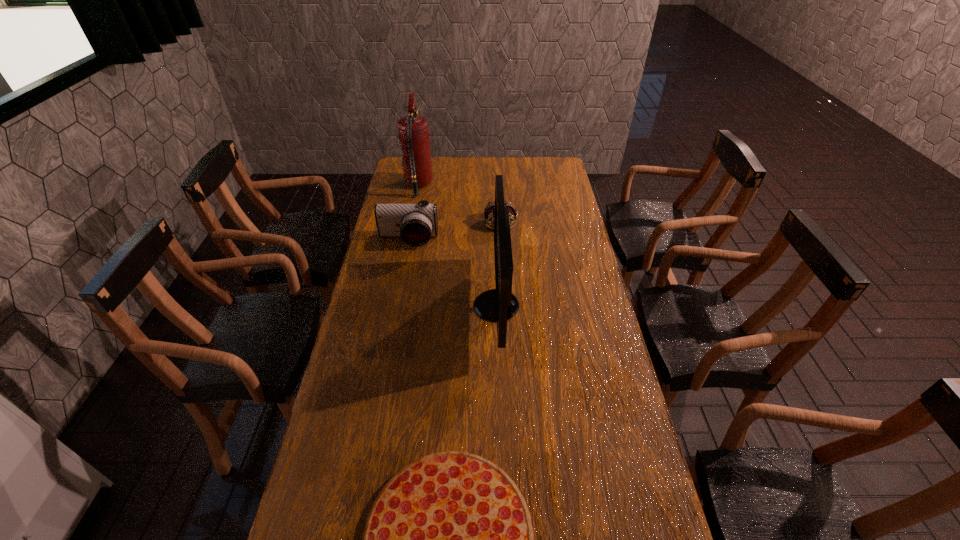
What are the coordinates of `the farthest object` in the screenshot? It's located at (413, 130).

I want to click on the second nearest object, so click(499, 304).

You are a GUI agent. You are given a task and a screenshot of the screen. Output one action in this format:
    pyautogui.click(x=<x>, y=<y>)
    Task: Click on the third shortest object
    This screenshot has height=540, width=960.
    Given the screenshot: What is the action you would take?
    pyautogui.click(x=415, y=223)

Find the location of `crown`. crown is located at coordinates (488, 212).

Locate an element on the screen. vacant space located 0.240m at the front of the farthest object where the nozzle is aimed is located at coordinates (482, 185).

This screenshot has height=540, width=960. Find the location of `vacant space located 0.180m on the front-facing side of the computer monitor`. vacant space located 0.180m on the front-facing side of the computer monitor is located at coordinates (423, 306).

What are the coordinates of `vacant space situated on the front-facing side of the computer monitor` in the screenshot? It's located at (455, 306).

At what (x,y) coordinates should I click in order to perform the action: click on vacant space located 0.360m on the front-facing side of the computer monitor. Please return your answer as a coordinate pair (x, y). This screenshot has height=540, width=960. Looking at the image, I should click on (372, 306).

Image resolution: width=960 pixels, height=540 pixels. I want to click on vacant area located on the surface of the camcorder, so click(x=398, y=291).

This screenshot has height=540, width=960. I want to click on vacant space located 0.100m on the left of the crown, so click(x=459, y=222).